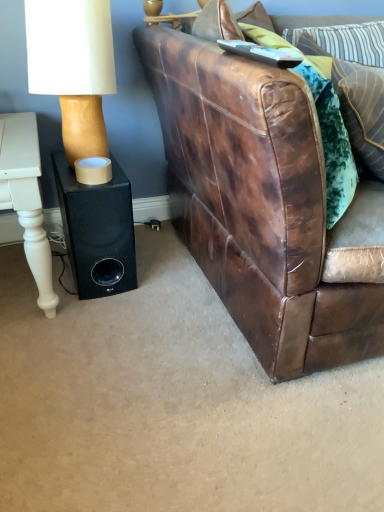
Question: Should I look upward or downward to see white matte lampshade at upper left?

Choices:
 (A) up
 (B) down

Answer: (A)

Question: From the image's perspective, is velvet green pillow at upper right, the 1th pillow ordered from the bottom, beneath black matte speaker at lower left?

Choices:
 (A) yes
 (B) no

Answer: (B)

Question: From a real-world perspective, is velvet green pillow at upper right, the 1th pillow ordered from the bottom, physically above black matte speaker at lower left?

Choices:
 (A) no
 (B) yes

Answer: (B)

Question: Is velvet green pillow at upper right, which is counted as the 3th pillow, starting from the top, far from black matte speaker at lower left?

Choices:
 (A) yes
 (B) no

Answer: (B)

Question: Does velvet green pillow at upper right, which is counted as the 3th pillow, starting from the top, have a lesser height compared to black matte speaker at lower left?

Choices:
 (A) yes
 (B) no

Answer: (B)

Question: Does velvet green pillow at upper right, the 1th pillow ordered from the bottom, have a smaller size compared to black matte speaker at lower left?

Choices:
 (A) no
 (B) yes

Answer: (A)

Question: Considering the relative sizes of velvet green pillow at upper right, which is counted as the 3th pillow, starting from the top, and black matte speaker at lower left in the image provided, is velvet green pillow at upper right, which is counted as the 3th pillow, starting from the top, bigger than black matte speaker at lower left?

Choices:
 (A) yes
 (B) no

Answer: (A)

Question: Are velvet green pillow at upper right, which is counted as the 3th pillow, starting from the top, and white matte lampshade at upper left far apart?

Choices:
 (A) no
 (B) yes

Answer: (A)

Question: Can white matte lampshade at upper left be found inside velvet green pillow at upper right, the 1th pillow ordered from the bottom?

Choices:
 (A) no
 (B) yes

Answer: (A)

Question: Considering the relative sizes of velvet green pillow at upper right, the 1th pillow ordered from the bottom, and white matte lampshade at upper left in the image provided, is velvet green pillow at upper right, the 1th pillow ordered from the bottom, thinner than white matte lampshade at upper left?

Choices:
 (A) no
 (B) yes

Answer: (B)

Question: Is velvet green pillow at upper right, which is counted as the 3th pillow, starting from the top, located outside white matte lampshade at upper left?

Choices:
 (A) yes
 (B) no

Answer: (A)

Question: Is velvet green pillow at upper right, the 1th pillow ordered from the bottom, next to white matte lampshade at upper left and touching it?

Choices:
 (A) yes
 (B) no

Answer: (B)

Question: Can you confirm if velvet green pillow at upper right, the 1th pillow ordered from the bottom, is shorter than white matte lampshade at upper left?

Choices:
 (A) yes
 (B) no

Answer: (B)

Question: From a real-world perspective, is brown leather couch at right on velvet green pillow at upper right, the 1th pillow ordered from the bottom?

Choices:
 (A) no
 (B) yes

Answer: (A)